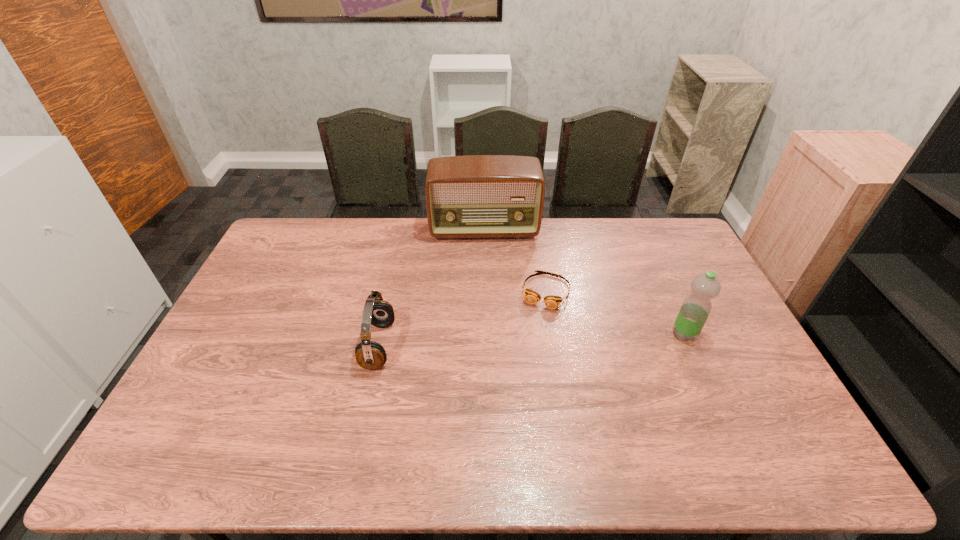
The image size is (960, 540). In order to click on the leftmost object in this screenshot , I will do `click(370, 355)`.

Locate an element on the screen. This screenshot has height=540, width=960. the third tallest object is located at coordinates (370, 355).

This screenshot has height=540, width=960. In order to click on the second tallest object in this screenshot , I will do `click(696, 307)`.

Image resolution: width=960 pixels, height=540 pixels. I want to click on water bottle, so click(x=696, y=307).

Locate an element on the screen. The height and width of the screenshot is (540, 960). the farthest object is located at coordinates (475, 196).

I want to click on goggles, so click(x=552, y=302).

Identify the location of the third nearest object. The width and height of the screenshot is (960, 540). tap(552, 302).

Locate an element on the screen. This screenshot has width=960, height=540. vacant region located 0.200m on the ear cups of the leftmost object is located at coordinates (297, 346).

The width and height of the screenshot is (960, 540). What are the coordinates of `free space located 0.250m on the ear cups of the leftmost object` in the screenshot? It's located at (279, 346).

Where is `vacant region located on the ear cups of the leftmost object`? vacant region located on the ear cups of the leftmost object is located at coordinates (297, 346).